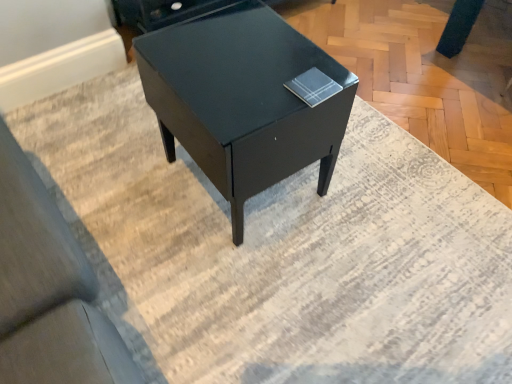
The height and width of the screenshot is (384, 512). I want to click on matte black table at center, so click(x=243, y=101).

The image size is (512, 384). Describe the element at coordinates (243, 101) in the screenshot. I see `matte black table at center` at that location.

The height and width of the screenshot is (384, 512). Find the location of `matte black table at center`. matte black table at center is located at coordinates (243, 101).